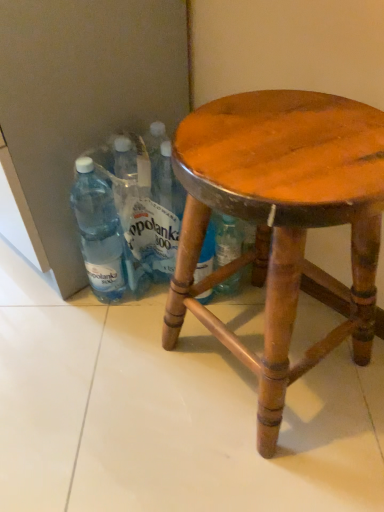
Locate an element on the screen. space that is in front of transparent plastic bottles at lower left is located at coordinates (130, 338).